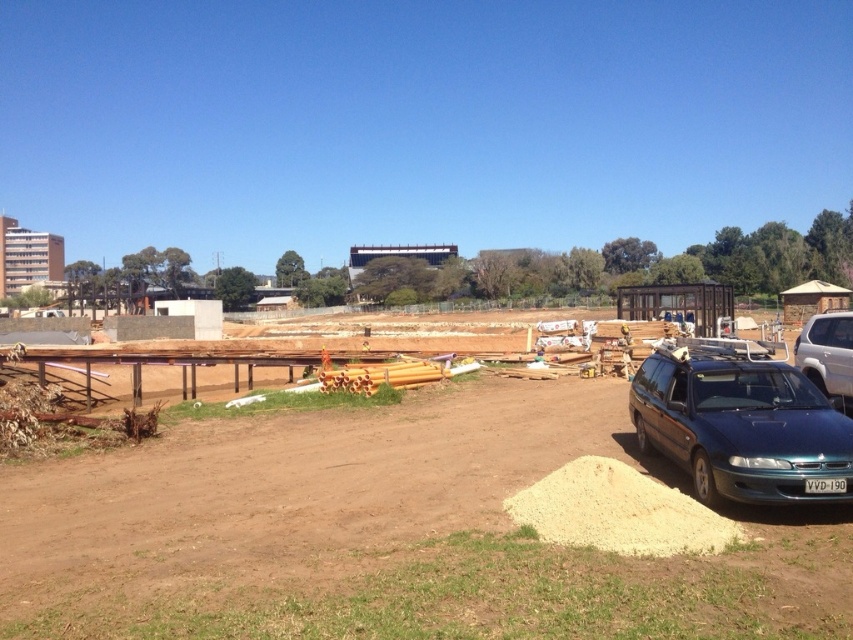
Which is below, metallic blue station wagon at lower right or light brown gravel at lower right?

light brown gravel at lower right is lower down.

What do you see at coordinates (740, 424) in the screenshot? I see `metallic blue station wagon at lower right` at bounding box center [740, 424].

Does point (666, 410) come in front of point (645, 480)?

No, it is behind (645, 480).

The width and height of the screenshot is (853, 640). What are the coordinates of `metallic blue station wagon at lower right` in the screenshot? It's located at (740, 424).

Is point (701, 353) positioned after point (851, 368)?

No, (701, 353) is closer to viewer.

Between metallic blue station wagon at lower right and satin white suv at right, which one is positioned lower?

Positioned lower is metallic blue station wagon at lower right.

Which is in front, point (683, 349) or point (846, 365)?

Positioned in front is point (683, 349).

Locate an element on the screen. metallic blue station wagon at lower right is located at coordinates (740, 424).

Is light brown gravel at lower right to the right of satin white suv at right from the viewer's perspective?

Incorrect, light brown gravel at lower right is not on the right side of satin white suv at right.

From the picture: Who is more distant from viewer, [599,540] or [833,348]?

Positioned behind is point [833,348].

Locate an element on the screen. light brown gravel at lower right is located at coordinates (618, 512).